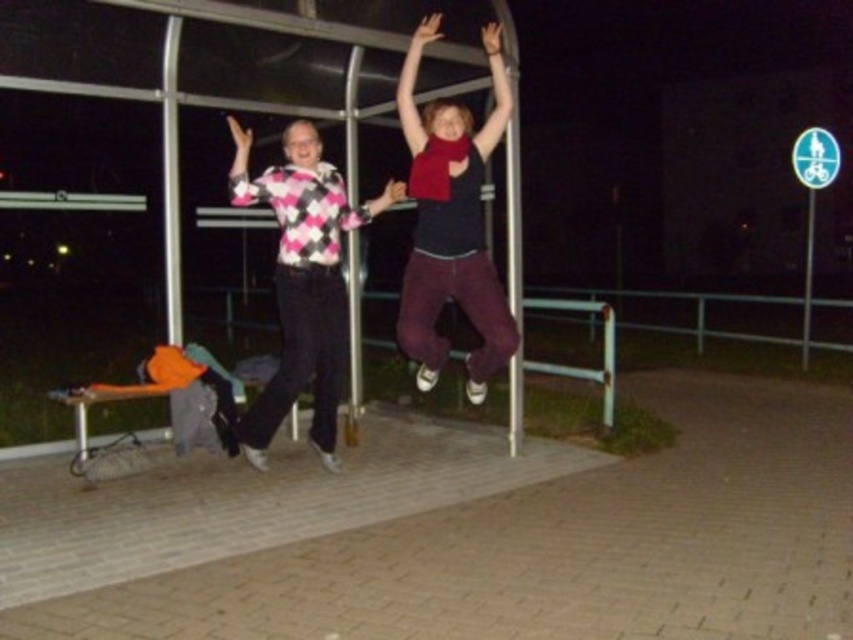
Question: Is matte red scarf at upper center positioned at the back of pink argyle sweater at center?

Choices:
 (A) no
 (B) yes

Answer: (B)

Question: Among these objects, which one is nearest to the camera?

Choices:
 (A) matte red scarf at upper center
 (B) pink argyle sweater at center

Answer: (B)

Question: Does matte red scarf at upper center appear under pink argyle sweater at center?

Choices:
 (A) yes
 (B) no

Answer: (B)

Question: Is matte red scarf at upper center to the right of pink argyle sweater at center from the viewer's perspective?

Choices:
 (A) no
 (B) yes

Answer: (B)

Question: Which of the following is the farthest from the observer?

Choices:
 (A) matte red scarf at upper center
 (B) pink argyle sweater at center

Answer: (A)